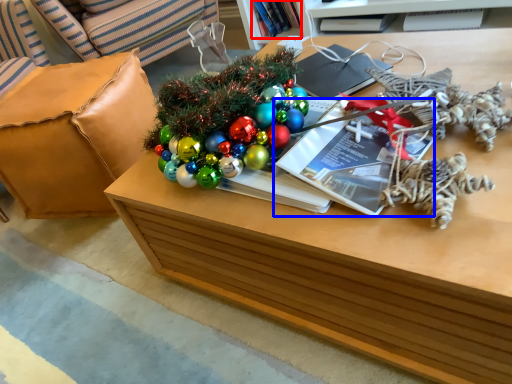
Question: Which object appears closest to the camera in this image, book (highlighted by a red box) or magazine (highlighted by a blue box)?

Choices:
 (A) book
 (B) magazine

Answer: (B)